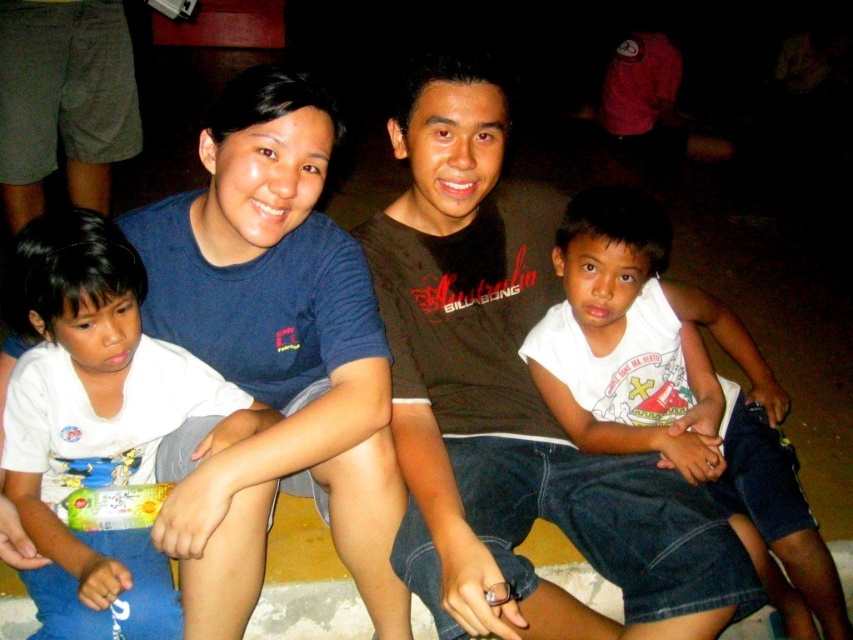
Between brown cotton shirt at center and white cotton shirt at left, which one is positioned lower?

white cotton shirt at left is lower down.

Is brown cotton shirt at center bigger than white cotton shirt at left?

Indeed, brown cotton shirt at center has a larger size compared to white cotton shirt at left.

Describe the element at coordinates (512, 401) in the screenshot. The height and width of the screenshot is (640, 853). I see `brown cotton shirt at center` at that location.

You are a GUI agent. You are given a task and a screenshot of the screen. Output one action in this format:
    pyautogui.click(x=<x>, y=<y>)
    Task: Click on the brown cotton shirt at center
    This screenshot has width=853, height=640.
    Given the screenshot: What is the action you would take?
    pyautogui.click(x=512, y=401)

Can you confirm if brown cotton shirt at center is bigger than white cotton shirt at lower right?

Yes, brown cotton shirt at center is bigger than white cotton shirt at lower right.

Does point (676, 625) come in front of point (624, 404)?

Yes, point (676, 625) is closer to viewer.

Where is `brown cotton shirt at center`? This screenshot has height=640, width=853. brown cotton shirt at center is located at coordinates (512, 401).

Does white cotton shirt at left have a lesser height compared to white cotton shirt at lower right?

Yes, white cotton shirt at left is shorter than white cotton shirt at lower right.

Between point (165, 573) and point (614, 342), which one is positioned in front?

Positioned in front is point (165, 573).

Who is more distant from viewer, (195, 380) or (561, 353)?

The point (561, 353) is behind.

Identify the location of white cotton shirt at left. (93, 422).